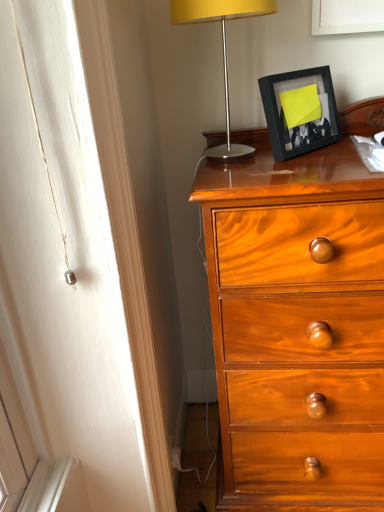
In order to face black matte picture frame at upper right, should I rotate leftwards or rightwards?

Turn right approximately 14.412 degrees to face it.

I want to click on black matte picture frame at upper right, so click(x=299, y=111).

Image resolution: width=384 pixels, height=512 pixels. What do you see at coordinates (299, 111) in the screenshot?
I see `black matte picture frame at upper right` at bounding box center [299, 111].

Locate an element on the screen. This screenshot has height=512, width=384. metallic silver lamp at upper right is located at coordinates (223, 49).

Describe the element at coordinates (223, 49) in the screenshot. I see `metallic silver lamp at upper right` at that location.

Identify the location of black matte picture frame at upper right. The image size is (384, 512). tap(299, 111).

Is black matte picture frame at upper right to the right of metallic silver lamp at upper right from the viewer's perspective?

Yes.

Which is in front, black matte picture frame at upper right or metallic silver lamp at upper right?

Positioned in front is metallic silver lamp at upper right.

Which is closer to the camera, (279, 156) or (200, 16)?

Point (279, 156) is positioned farther from the camera compared to point (200, 16).

From the image's perspective, is black matte picture frame at upper right below metallic silver lamp at upper right?

Yes.

From a real-world perspective, does black matte picture frame at upper right stand above metallic silver lamp at upper right?

Incorrect, from a real-world perspective, black matte picture frame at upper right is lower than metallic silver lamp at upper right.

Which object is wider, black matte picture frame at upper right or metallic silver lamp at upper right?

metallic silver lamp at upper right is wider.

Does black matte picture frame at upper right have a greater height compared to metallic silver lamp at upper right?

No.

Does black matte picture frame at upper right have a larger size compared to metallic silver lamp at upper right?

No.

Is metallic silver lamp at upper right inside black matte picture frame at upper right?

No, metallic silver lamp at upper right is not inside black matte picture frame at upper right.

Is black matte picture frame at upper right far from metallic silver lamp at upper right?

No, black matte picture frame at upper right is not far from metallic silver lamp at upper right.

Is black matte picture frame at upper right facing away from metallic silver lamp at upper right?

Yes, black matte picture frame at upper right's orientation is away from metallic silver lamp at upper right.

How far apart are black matte picture frame at upper right and metallic silver lamp at upper right?

black matte picture frame at upper right and metallic silver lamp at upper right are 6.47 inches apart.

Locate an element on the screen. lamp in front of the black matte picture frame at upper right is located at coordinates pyautogui.click(x=223, y=49).

Is metallic silver lamp at upper right at the left side of black matte picture frame at upper right?

Yes, metallic silver lamp at upper right is to the left of black matte picture frame at upper right.

Is metallic silver lamp at upper right closer to camera compared to black matte picture frame at upper right?

Yes, it is.

Considering the points (223, 11) and (276, 90), which point is behind, point (223, 11) or point (276, 90)?

The point (276, 90) is farther from the camera.

Consider the image. From the image's perspective, is metallic silver lamp at upper right above black matte picture frame at upper right?

Yes, from the image's perspective, metallic silver lamp at upper right is over black matte picture frame at upper right.

Looking at this image, from a real-world perspective, between metallic silver lamp at upper right and black matte picture frame at upper right, who is vertically lower?

black matte picture frame at upper right, from a real-world perspective.

Considering the relative sizes of metallic silver lamp at upper right and black matte picture frame at upper right in the image provided, is metallic silver lamp at upper right wider than black matte picture frame at upper right?

Correct, the width of metallic silver lamp at upper right exceeds that of black matte picture frame at upper right.

Considering the relative sizes of metallic silver lamp at upper right and black matte picture frame at upper right in the image provided, is metallic silver lamp at upper right taller than black matte picture frame at upper right?

Yes.

Considering the sizes of objects metallic silver lamp at upper right and black matte picture frame at upper right in the image provided, who is bigger, metallic silver lamp at upper right or black matte picture frame at upper right?

Bigger between the two is metallic silver lamp at upper right.

From the picture: Is black matte picture frame at upper right completely or partially inside metallic silver lamp at upper right?

No, black matte picture frame at upper right is not inside metallic silver lamp at upper right.

Is there a large distance between metallic silver lamp at upper right and black matte picture frame at upper right?

No, there isn't a large distance between metallic silver lamp at upper right and black matte picture frame at upper right.

Looking at this image, is metallic silver lamp at upper right oriented away from black matte picture frame at upper right?

metallic silver lamp at upper right is not turned away from black matte picture frame at upper right.

In order to click on lamp to the left of black matte picture frame at upper right in this screenshot , I will do `click(223, 49)`.

Where is `picture frame below the metallic silver lamp at upper right (from the image's perspective)`? picture frame below the metallic silver lamp at upper right (from the image's perspective) is located at coordinates (299, 111).

Find the location of a particular element. The height and width of the screenshot is (512, 384). lamp located above the black matte picture frame at upper right (from the image's perspective) is located at coordinates (223, 49).